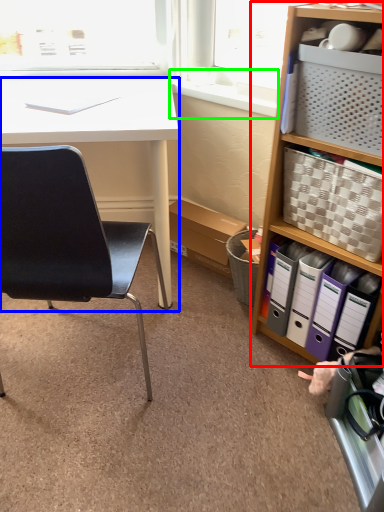
Question: Which object is the closest to the bookcase (highlighted by a red box)? Choose among these: desk (highlighted by a blue box) or window sill (highlighted by a green box).

Choices:
 (A) desk
 (B) window sill

Answer: (B)